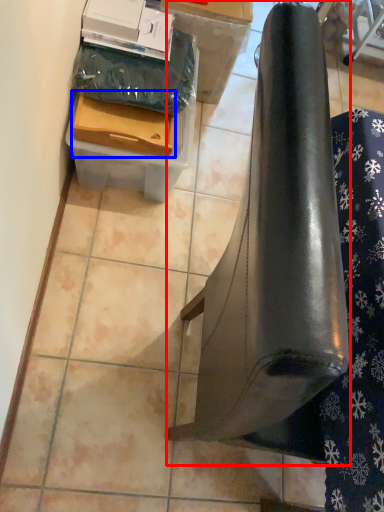
Question: Which point is closer to the camera, furniture (highlighted by a red box) or drawer (highlighted by a blue box)?

Choices:
 (A) furniture
 (B) drawer

Answer: (A)